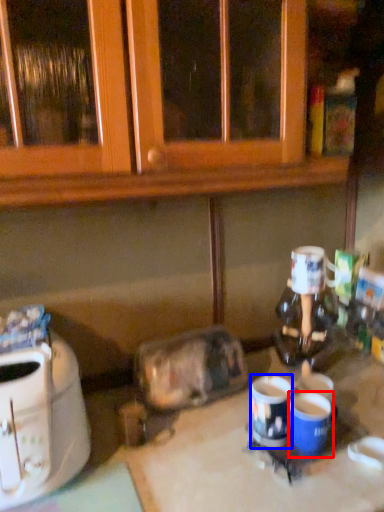
Question: Among these objects, which one is farthest to the camera, coffee cup (highlighted by a red box) or coffee cup (highlighted by a blue box)?

Choices:
 (A) coffee cup
 (B) coffee cup

Answer: (B)